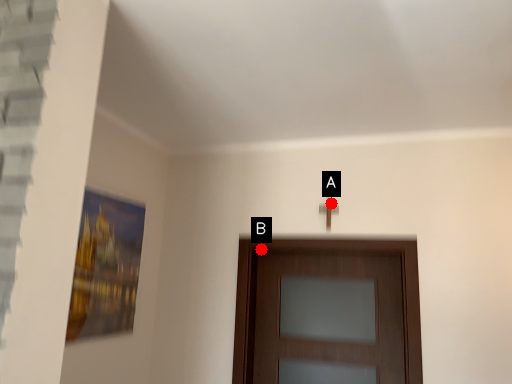
Question: Two points are circled on the image, labeled by A and B beside each circle. Among these points, which one is nearest to the camera?

Choices:
 (A) A is closer
 (B) B is closer

Answer: (A)